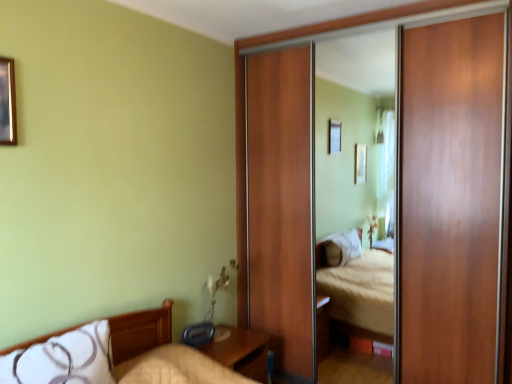
Question: Is wooden sliding door at right at the right side of white soft pillow at lower left?

Choices:
 (A) yes
 (B) no

Answer: (A)

Question: Is wooden sliding door at right bigger than white soft pillow at lower left?

Choices:
 (A) yes
 (B) no

Answer: (A)

Question: From the image's perspective, is wooden sliding door at right over white soft pillow at lower left?

Choices:
 (A) yes
 (B) no

Answer: (A)

Question: Is wooden sliding door at right smaller than white soft pillow at lower left?

Choices:
 (A) no
 (B) yes

Answer: (A)

Question: Is wooden sliding door at right facing away from white soft pillow at lower left?

Choices:
 (A) no
 (B) yes

Answer: (A)

Question: Does wooden sliding door at right turn towards white soft pillow at lower left?

Choices:
 (A) no
 (B) yes

Answer: (B)

Question: Does wooden nightstand at lower center have a lesser width compared to white soft pillow at lower left?

Choices:
 (A) yes
 (B) no

Answer: (B)

Question: Can you confirm if wooden nightstand at lower center is positioned to the right of white soft pillow at lower left?

Choices:
 (A) yes
 (B) no

Answer: (A)

Question: Is wooden nightstand at lower center touching white soft pillow at lower left?

Choices:
 (A) yes
 (B) no

Answer: (B)

Question: Considering the relative sizes of wooden nightstand at lower center and white soft pillow at lower left in the image provided, is wooden nightstand at lower center shorter than white soft pillow at lower left?

Choices:
 (A) no
 (B) yes

Answer: (A)

Question: Considering the relative sizes of wooden nightstand at lower center and white soft pillow at lower left in the image provided, is wooden nightstand at lower center wider than white soft pillow at lower left?

Choices:
 (A) no
 (B) yes

Answer: (B)

Question: Is wooden nightstand at lower center oriented towards white soft pillow at lower left?

Choices:
 (A) yes
 (B) no

Answer: (B)

Question: Is wooden picture frame at upper left wider than wooden sliding door at right?

Choices:
 (A) no
 (B) yes

Answer: (A)